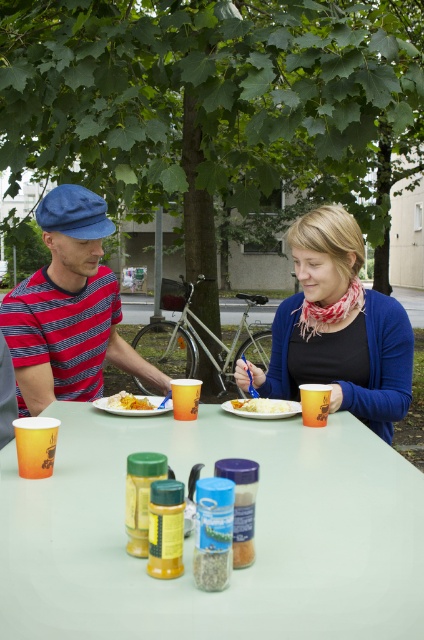
Can you confirm if striped cotton shirt at left is positioned above yellow matte plate at center?

Correct, striped cotton shirt at left is located above yellow matte plate at center.

Which of these two, striped cotton shirt at left or yellow matte plate at center, stands taller?

striped cotton shirt at left is taller.

Who is more distant from viewer, (78,209) or (133,396)?

Point (78,209)

I want to click on striped cotton shirt at left, so click(69, 308).

Is matte plastic plate at center in front of white matte rice at center?

Yes, it is.

Is matte plastic plate at center bigger than white matte rice at center?

Yes, matte plastic plate at center is bigger than white matte rice at center.

This screenshot has width=424, height=640. What do you see at coordinates (133, 408) in the screenshot?
I see `matte plastic plate at center` at bounding box center [133, 408].

This screenshot has width=424, height=640. What are the coordinates of `matte plastic plate at center` in the screenshot? It's located at (133, 408).

Can you confirm if matte striped shirt at left is wider than striped cotton shirt at left?

In fact, matte striped shirt at left might be narrower than striped cotton shirt at left.

Between matte striped shirt at left and striped cotton shirt at left, which one appears on the right side from the viewer's perspective?

Positioned to the right is matte striped shirt at left.

Image resolution: width=424 pixels, height=640 pixels. What do you see at coordinates (337, 328) in the screenshot? I see `matte striped shirt at left` at bounding box center [337, 328].

Find the location of a particular element. matte striped shirt at left is located at coordinates (337, 328).